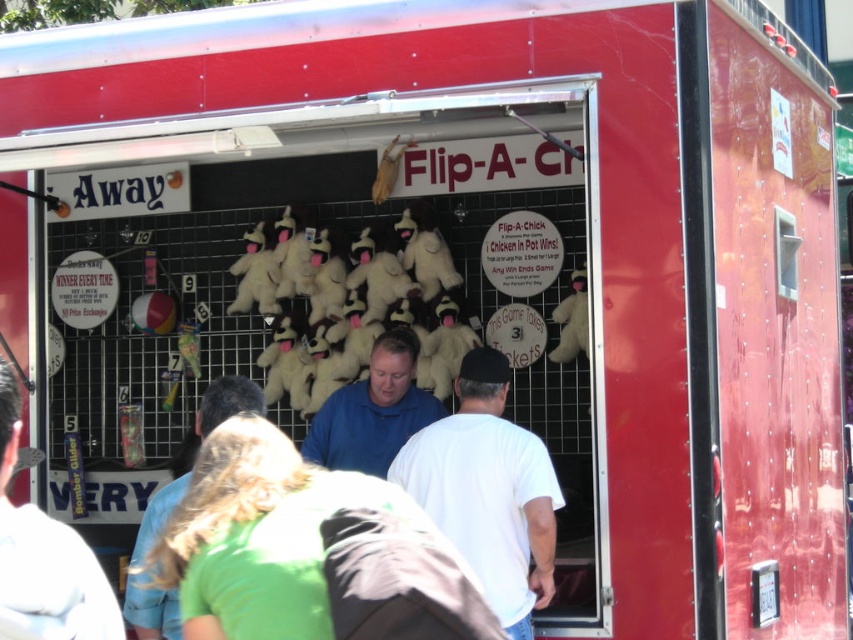
Can you confirm if white matte shirt at center is positioned below light blue shirt at center?

No.

Looking at this image, does white matte shirt at center appear on the right side of light blue shirt at center?

Yes, white matte shirt at center is to the right of light blue shirt at center.

Describe the element at coordinates (488, 490) in the screenshot. Image resolution: width=853 pixels, height=640 pixels. I see `white matte shirt at center` at that location.

Find the location of `white matte shirt at center`. white matte shirt at center is located at coordinates (488, 490).

Does white matte shirt at center lie in front of blue matte shirt at center?

Yes, it is.

Does white matte shirt at center appear on the left side of blue matte shirt at center?

Incorrect, white matte shirt at center is not on the left side of blue matte shirt at center.

Identify the location of white matte shirt at center. (488, 490).

Is blue matte shirt at center above light blue shirt at center?

Correct, blue matte shirt at center is located above light blue shirt at center.

Which is above, blue matte shirt at center or light blue shirt at center?

blue matte shirt at center

Which is behind, point (349, 406) or point (229, 378)?

Point (349, 406)

Identify the location of blue matte shirt at center. The width and height of the screenshot is (853, 640). (373, 412).